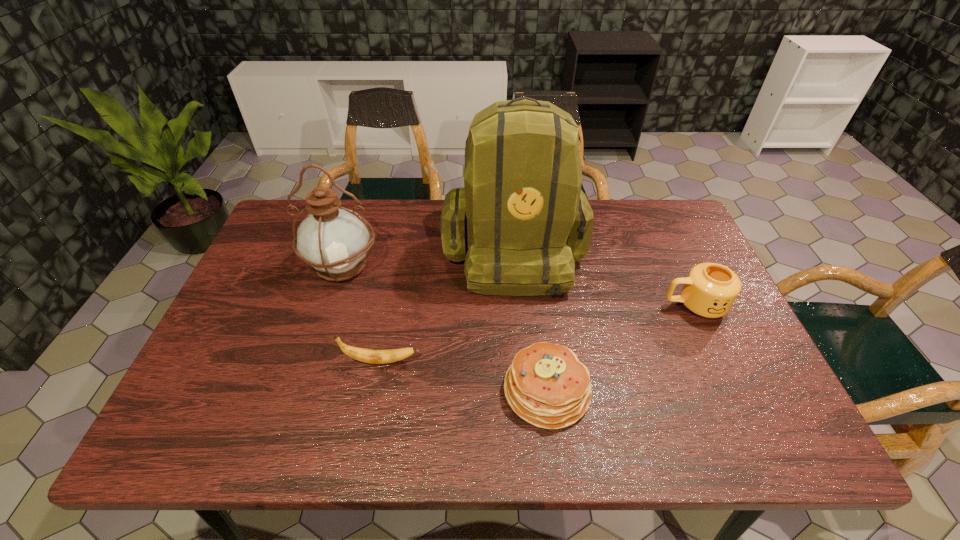
At what (x,y) coordinates should I click in order to perform the action: click on vacant area that lies between the pancake and the third shortest object. Please return your answer as a coordinate pair (x, y). Looking at the image, I should click on tap(620, 348).

Where is `empty location between the banana and the second tallest object`? The height and width of the screenshot is (540, 960). empty location between the banana and the second tallest object is located at coordinates (362, 314).

Image resolution: width=960 pixels, height=540 pixels. I want to click on the fourth closest object to the second tallest object, so click(x=710, y=289).

The image size is (960, 540). What are the coordinates of `object that stands as the closest to the mug` in the screenshot? It's located at click(x=527, y=221).

Find the location of a particular element. vacant point that satisfies the following two spatial constraints: 1. on the back side of the pancake; 2. on the peel of the banana from the top is located at coordinates (543, 361).

Where is `vacant point that satisfies the following two spatial constraints: 1. on the front side of the pancake; 2. on the right side of the fourth shortest object`? The height and width of the screenshot is (540, 960). vacant point that satisfies the following two spatial constraints: 1. on the front side of the pancake; 2. on the right side of the fourth shortest object is located at coordinates (303, 390).

Where is `free space that satisfies the following two spatial constraints: 1. on the front side of the pancake; 2. on the left side of the second tallest object`? This screenshot has height=540, width=960. free space that satisfies the following two spatial constraints: 1. on the front side of the pancake; 2. on the left side of the second tallest object is located at coordinates pyautogui.click(x=303, y=390).

This screenshot has height=540, width=960. Find the location of `vacant position in the image that satisfies the following two spatial constraints: 1. on the peel of the banana from the top; 2. on the left side of the pancake`. vacant position in the image that satisfies the following two spatial constraints: 1. on the peel of the banana from the top; 2. on the left side of the pancake is located at coordinates (375, 390).

The image size is (960, 540). I want to click on free spot that satisfies the following two spatial constraints: 1. on the back side of the pancake; 2. on the peel of the banana from the top, so click(x=543, y=361).

You are a GUI agent. You are given a task and a screenshot of the screen. Output one action in this format:
    pyautogui.click(x=<x>, y=<y>)
    Task: Click on the vacant point that satisfies the following two spatial constraints: 1. on the peel of the banana from the top; 2. on the right side of the pancake
    This screenshot has width=960, height=540.
    Given the screenshot: What is the action you would take?
    pyautogui.click(x=375, y=390)